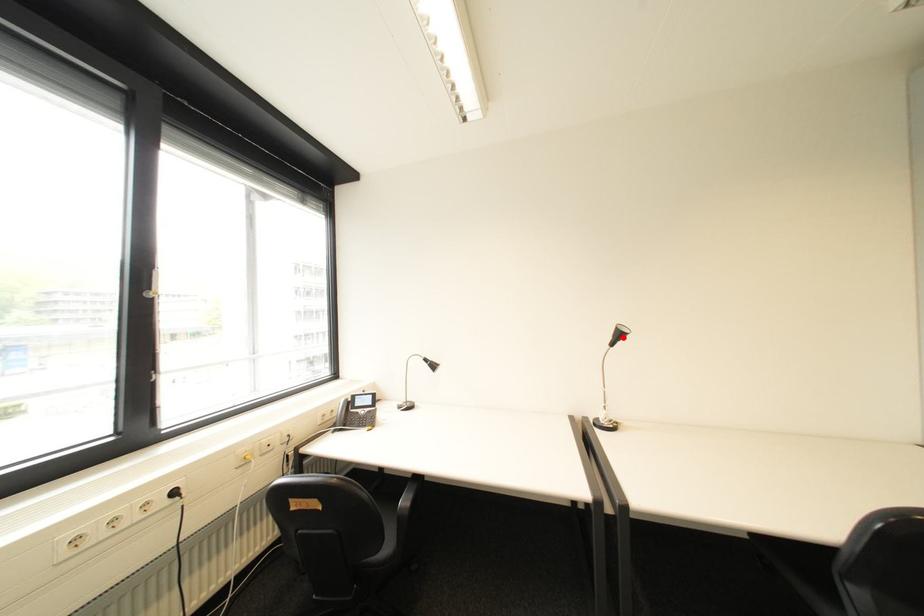
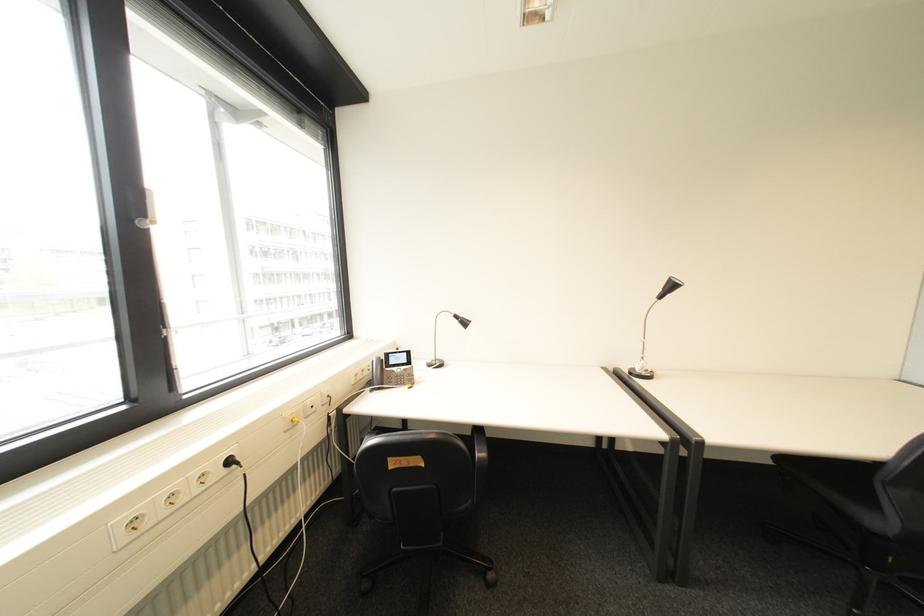
In the second image, find the point that corresponds to the highlighted location in the first image.

(673, 290)